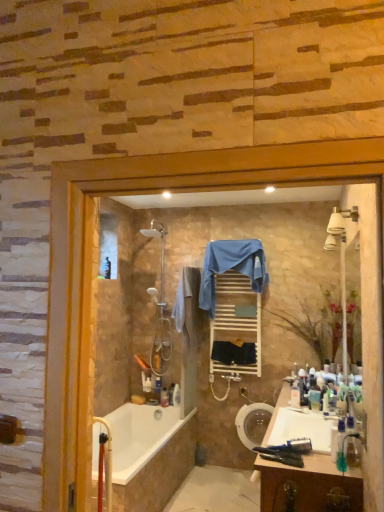
Image resolution: width=384 pixels, height=512 pixels. What do you see at coordinates (149, 455) in the screenshot?
I see `white glossy bathtub at lower left` at bounding box center [149, 455].

The height and width of the screenshot is (512, 384). What do you see at coordinates (160, 310) in the screenshot?
I see `polished chrome shower at center` at bounding box center [160, 310].

Measure the distance between point [148,288] and camera.

They are 14.87 feet apart.

How much space does translucent plastic bottle at lower center, arranged as the 1th toiletry when viewed from the back, occupy horizontally?

translucent plastic bottle at lower center, arranged as the 1th toiletry when viewed from the back, is 4.19 inches wide.

The width and height of the screenshot is (384, 512). Find the location of `translucent plastic bottle at lower center, the 1th toiletry viewed from the left`. translucent plastic bottle at lower center, the 1th toiletry viewed from the left is located at coordinates (164, 397).

At what (x,y) coordinates should I click in order to perform the action: click on beige cotton bath towel at center, acting as the 3th bath towel starting from the right. Please return your answer as a coordinate pair (x, y). Image resolution: width=384 pixels, height=512 pixels. Looking at the image, I should click on (188, 312).

Image resolution: width=384 pixels, height=512 pixels. Describe the element at coordinates (234, 353) in the screenshot. I see `dark blue fabric at center, positioned as the first bath towel in right-to-left order` at that location.

Measure the distance between white glossy sink at lower right and camera.

They are 2.19 meters apart.

This screenshot has height=512, width=384. In order to click on white glossy bathtub at lower left in this screenshot , I will do `click(149, 455)`.

Which of these two, wooden cabinet at lower right or white wooden towel rack at center, is thinner?

white wooden towel rack at center is thinner.

Between wooden cabinet at lower right and white wooden towel rack at center, which one is positioned in front?

wooden cabinet at lower right is in front.

Which point is more forward, (267, 475) or (249, 339)?

The point (267, 475) is closer.

From a real-world perspective, which object rests below the other?

wooden cabinet at lower right.

Locate an element on the screen. Image resolution: width=384 pixels, height=512 pixels. toiletry that is the 3rd one when counting rightward from the beige cotton bath towel at center, placed as the 1th bath towel when sorted from left to right is located at coordinates (342, 397).

Considering the relative sizes of translucent plastic bottle at lower right, acting as the 1th toiletry starting from the front, and beige cotton bath towel at center, acting as the 3th bath towel starting from the right, in the image provided, is translucent plastic bottle at lower right, acting as the 1th toiletry starting from the front, shorter than beige cotton bath towel at center, acting as the 3th bath towel starting from the right,?

Indeed, translucent plastic bottle at lower right, acting as the 1th toiletry starting from the front, has a lesser height compared to beige cotton bath towel at center, acting as the 3th bath towel starting from the right.

Is translucent plastic bottle at lower right, acting as the 1th toiletry starting from the front, positioned beyond the bounds of beige cotton bath towel at center, acting as the 3th bath towel starting from the right?

Yes, translucent plastic bottle at lower right, acting as the 1th toiletry starting from the front, is outside of beige cotton bath towel at center, acting as the 3th bath towel starting from the right.

Can you confirm if translucent plastic bottle at lower right, marked as the 1th toiletry in a right-to-left arrangement, is taller than white glossy bathtub at lower left?

In fact, translucent plastic bottle at lower right, marked as the 1th toiletry in a right-to-left arrangement, may be shorter than white glossy bathtub at lower left.

From the image's perspective, is translucent plastic bottle at lower right, the 4th toiletry positioned from the left, positioned above or below white glossy bathtub at lower left?

translucent plastic bottle at lower right, the 4th toiletry positioned from the left, is situated higher than white glossy bathtub at lower left in the image.

In the image, is translucent plastic bottle at lower right, acting as the 1th toiletry starting from the front, on the left side or the right side of white glossy bathtub at lower left?

Clearly, translucent plastic bottle at lower right, acting as the 1th toiletry starting from the front, is on the right of white glossy bathtub at lower left in the image.

The width and height of the screenshot is (384, 512). I want to click on bathtub below the translucent plastic bottle at lower right, acting as the 1th toiletry starting from the front (from the image's perspective), so click(x=149, y=455).

Are clear plastic bottle at lower right, arranged as the 2th toiletry when viewed from the left, and blue fabric towel at center, placed as the 2th bath towel when sorted from left to right, far apart?

Yes, clear plastic bottle at lower right, arranged as the 2th toiletry when viewed from the left, and blue fabric towel at center, placed as the 2th bath towel when sorted from left to right, are located far from each other.

From a real-world perspective, who is located higher, clear plastic bottle at lower right, arranged as the 2th toiletry when viewed from the left, or blue fabric towel at center, placed as the 2th bath towel when sorted from left to right?

blue fabric towel at center, placed as the 2th bath towel when sorted from left to right, is physically above.

Based on the photo, in the image, is clear plastic bottle at lower right, the third toiletry viewed from the right, positioned in front of or behind blue fabric towel at center, which ranks as the 2th bath towel in right-to-left order?

In the image, clear plastic bottle at lower right, the third toiletry viewed from the right, appears in front of blue fabric towel at center, which ranks as the 2th bath towel in right-to-left order.

Considering the sizes of objects clear plastic bottle at lower right, arranged as the 2th toiletry when viewed from the left, and blue fabric towel at center, placed as the 2th bath towel when sorted from left to right, in the image provided, who is wider, clear plastic bottle at lower right, arranged as the 2th toiletry when viewed from the left, or blue fabric towel at center, placed as the 2th bath towel when sorted from left to right,?

blue fabric towel at center, placed as the 2th bath towel when sorted from left to right.

From their relative heights in the image, would you say translucent plastic bottle at lower center, which ranks as the 4th toiletry in right-to-left order, is taller or shorter than clear plastic bottle at lower right, which ranks as the 3th toiletry in top-to-bottom order?

In the image, translucent plastic bottle at lower center, which ranks as the 4th toiletry in right-to-left order, appears to be shorter than clear plastic bottle at lower right, which ranks as the 3th toiletry in top-to-bottom order.

Looking at this image, is translucent plastic bottle at lower center, the 1th toiletry in the bottom-to-top sequence, positioned with its back to clear plastic bottle at lower right, the third toiletry viewed from the front?

translucent plastic bottle at lower center, the 1th toiletry in the bottom-to-top sequence, is not turned away from clear plastic bottle at lower right, the third toiletry viewed from the front.

Considering the sizes of translucent plastic bottle at lower center, the 1th toiletry viewed from the left, and clear plastic bottle at lower right, the second toiletry when ordered from bottom to top, in the image, is translucent plastic bottle at lower center, the 1th toiletry viewed from the left, bigger or smaller than clear plastic bottle at lower right, the second toiletry when ordered from bottom to top,?

Clearly, translucent plastic bottle at lower center, the 1th toiletry viewed from the left, is larger in size than clear plastic bottle at lower right, the second toiletry when ordered from bottom to top.

Is translucent plastic bottle at lower center, the 1th toiletry viewed from the left, next to clear plastic bottle at lower right, which appears as the second toiletry when viewed from the back?

No, translucent plastic bottle at lower center, the 1th toiletry viewed from the left, is not with clear plastic bottle at lower right, which appears as the second toiletry when viewed from the back.

Is white glossy sink at lower right inside the boundaries of translucent plastic toothbrush at lower right, acting as the 3th toiletry starting from the left, or outside?

white glossy sink at lower right is outside translucent plastic toothbrush at lower right, acting as the 3th toiletry starting from the left.

Find the location of a particular element. the 2nd toiletry behind the white glossy sink at lower right is located at coordinates (314, 395).

Which object is further away from the camera taking this photo, white glossy sink at lower right or translucent plastic toothbrush at lower right, which is the second toiletry from right to left?

Positioned behind is translucent plastic toothbrush at lower right, which is the second toiletry from right to left.

Is white glossy sink at lower right facing away from translucent plastic toothbrush at lower right, arranged as the 3th toiletry when ordered from the bottom?

white glossy sink at lower right does not have its back to translucent plastic toothbrush at lower right, arranged as the 3th toiletry when ordered from the bottom.

Which point is more distant from viewer, [164,289] or [262,487]?

Point [164,289]

Is the position of polished chrome shower at center more distant than that of wooden cabinet at lower right?

Yes, it is behind wooden cabinet at lower right.

From a real-world perspective, relative to wooden cabinet at lower right, is polished chrome shower at center vertically above or below?

From a real-world perspective, polished chrome shower at center is physically above wooden cabinet at lower right.

Can you confirm if polished chrome shower at center is wider than wooden cabinet at lower right?

No.

At what (x,y) coordinates should I click in order to perform the action: click on shelf located behind the wooden cabinet at lower right. Please return your answer as a coordinate pair (x, y). Looking at the image, I should click on (236, 321).

Starting from the beige cotton bath towel at center, placed as the 1th bath towel when sorted from left to right, which toiletry is the 3rd one in front? Please provide its 2D coordinates.

[(342, 397)]

Estimate the real-world distances between objects in this image. Which object is closer to blue fabric towel at center, placed as the 2th bath towel when sorted from left to right, beige cotton bath towel at center, placed as the 1th bath towel when sorted from left to right, or white wooden towel rack at center?

Among the two, white wooden towel rack at center is located nearer to blue fabric towel at center, placed as the 2th bath towel when sorted from left to right.

Based on their spatial positions, is translucent plastic bottle at lower center, the 4th toiletry when ordered from front to back, or dark blue fabric at center, marked as the 3th bath towel in a left-to-right arrangement, closer to polished chrome shower at center?

translucent plastic bottle at lower center, the 4th toiletry when ordered from front to back.

Based on their spatial positions, is translucent plastic toothbrush at lower right, acting as the 2th toiletry starting from the front, or translucent plastic bottle at lower right, which is counted as the fourth toiletry, starting from the back, closer to white glossy bathtub at lower left?

translucent plastic toothbrush at lower right, acting as the 2th toiletry starting from the front.

Estimate the real-world distances between objects in this image. Which object is further from dark blue fabric at center, marked as the 3th bath towel in a left-to-right arrangement, translucent plastic toothbrush at lower right, the third toiletry when ordered from back to front, or translucent plastic bottle at lower right, the 1th toiletry from the top?

Among the two, translucent plastic bottle at lower right, the 1th toiletry from the top, is located further to dark blue fabric at center, marked as the 3th bath towel in a left-to-right arrangement.

Which object lies nearer to the anchor point translucent plastic bottle at lower center, the 4th toiletry when ordered from front to back, dark blue fabric at center, marked as the 3th bath towel in a left-to-right arrangement, or white glossy bathtub at lower left?

white glossy bathtub at lower left.

Estimate the real-world distances between objects in this image. Which object is closer to clear plastic bottle at lower right, which appears as the second toiletry when viewed from the back, dark blue fabric at center, positioned as the first bath towel in right-to-left order, or polished chrome shower at center?

Among the two, dark blue fabric at center, positioned as the first bath towel in right-to-left order, is located nearer to clear plastic bottle at lower right, which appears as the second toiletry when viewed from the back.

When comparing their distances from translucent plastic bottle at lower right, marked as the 1th toiletry in a right-to-left arrangement, does wooden cabinet at lower right or beige cotton bath towel at center, placed as the 1th bath towel when sorted from left to right, seem closer?

wooden cabinet at lower right is closer to translucent plastic bottle at lower right, marked as the 1th toiletry in a right-to-left arrangement.

Looking at this image, which object lies nearer to the anchor point polished chrome shower at center, beige cotton bath towel at center, placed as the 1th bath towel when sorted from left to right, or dark blue fabric at center, marked as the 3th bath towel in a left-to-right arrangement?

beige cotton bath towel at center, placed as the 1th bath towel when sorted from left to right, lies closer to polished chrome shower at center than the other object.

Where is `shelf between translucent plastic bottle at lower right, which is counted as the fourth toiletry, starting from the back, and translucent plastic bottle at lower center, the 1th toiletry viewed from the left, along the z-axis`? Image resolution: width=384 pixels, height=512 pixels. shelf between translucent plastic bottle at lower right, which is counted as the fourth toiletry, starting from the back, and translucent plastic bottle at lower center, the 1th toiletry viewed from the left, along the z-axis is located at coordinates (236, 321).

The height and width of the screenshot is (512, 384). What are the coordinates of `shower located between white glossy bathtub at lower left and clear plastic bottle at lower right, the third toiletry viewed from the front, in the left-right direction` in the screenshot? It's located at (160, 310).

Locate an element on the screen. This screenshot has height=512, width=384. shower between white glossy sink at lower right and translucent plastic bottle at lower center, marked as the fourth toiletry in a top-to-bottom arrangement, from front to back is located at coordinates (160, 310).

The width and height of the screenshot is (384, 512). Find the location of `bathtub positioned between white glossy sink at lower right and white wooden towel rack at center from near to far`. bathtub positioned between white glossy sink at lower right and white wooden towel rack at center from near to far is located at coordinates (149, 455).